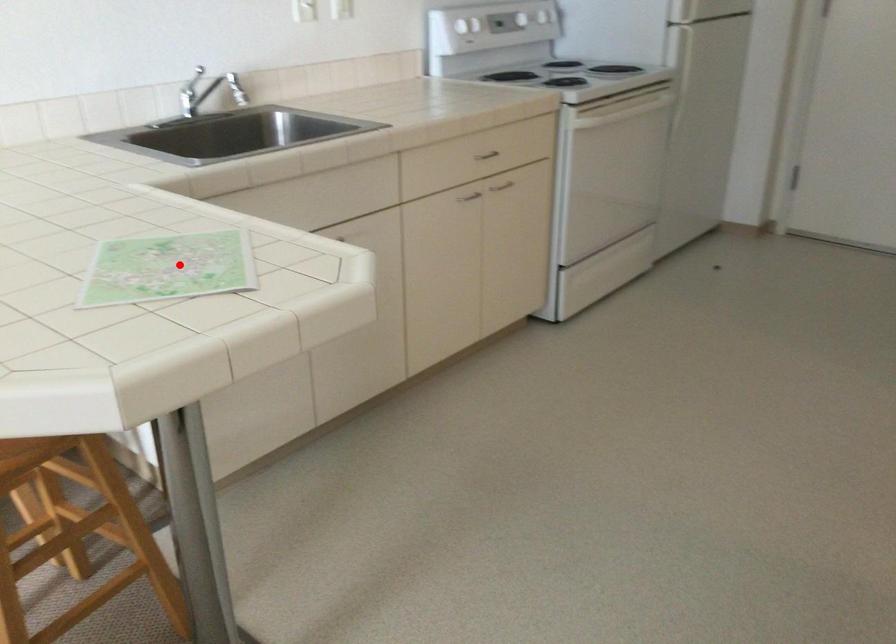
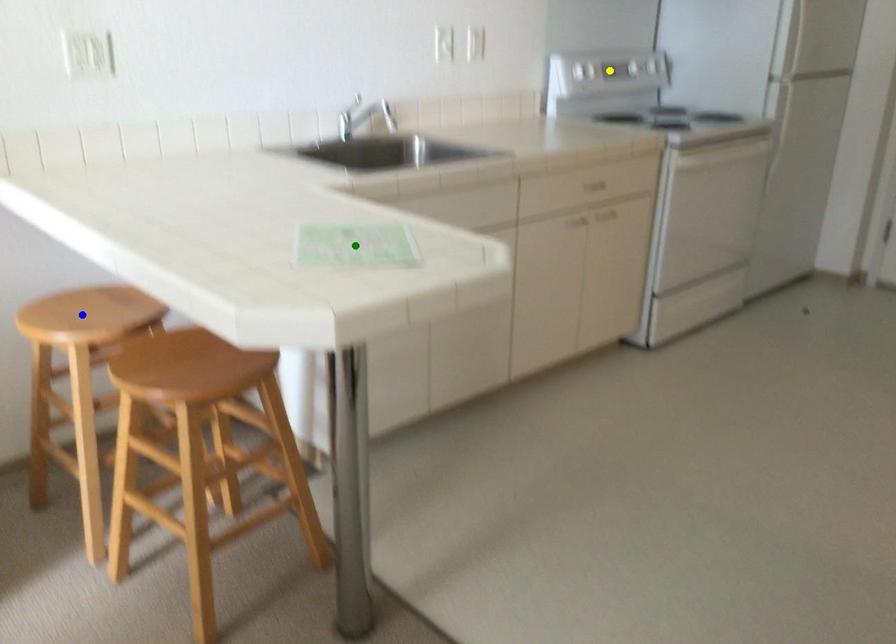
Question: I am providing you with two images of the same scene from different viewpoints. A red point is marked on the first image. You are given multiple points on the second image. Which point in image 2 represents the same 3d spot as the red point in image 1?

Choices:
 (A) green point
 (B) yellow point
 (C) blue point

Answer: (A)